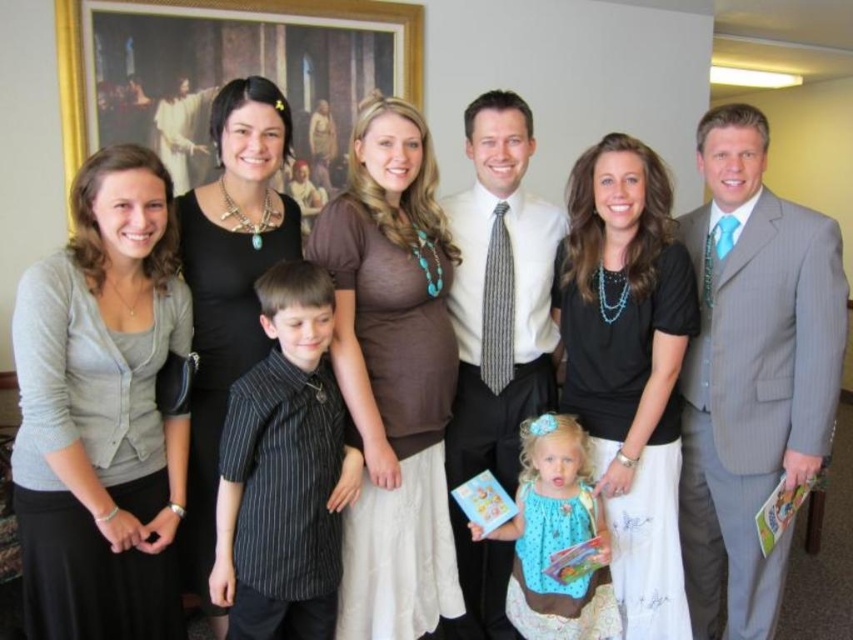
You are a photographer trying to capture a clear shot of both the black fabric dress at center and the polka dot fabric dress at center. Which dress is covering part of the other one?

The black fabric dress at center is positioned over the polka dot fabric dress at center, so it is covering part of it.

You are a photographer setting up for a family photo. You need to position two key subjects so that one is on the left and the other is in the center. The gray cardigan at left and the black matte dress at center are already positioned. Does the current arrangement meet your requirement?

Yes, the gray cardigan at left is positioned to the left of the black matte dress at center, which aligns with the requirement of having one on the left and the other in the center.

You are a photographer setting up for a family photo. You need to ensure that the gray cardigan at left and the black pinstripe shirt at center are both visible in the frame. Based on their positions, which one is higher up in the image?

The gray cardigan at left is located above the black pinstripe shirt at center, so it is higher up in the image.